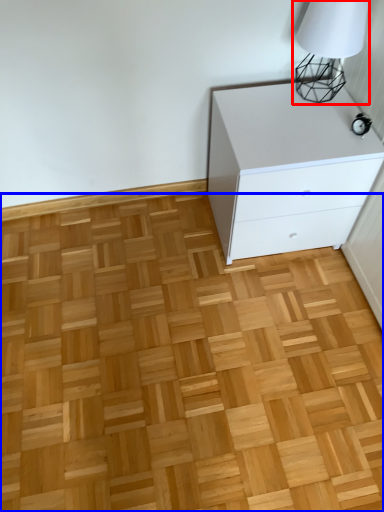
Question: Which of the following is the farthest to the observer, table lamp (highlighted by a red box) or hardwood (highlighted by a blue box)?

Choices:
 (A) table lamp
 (B) hardwood

Answer: (A)